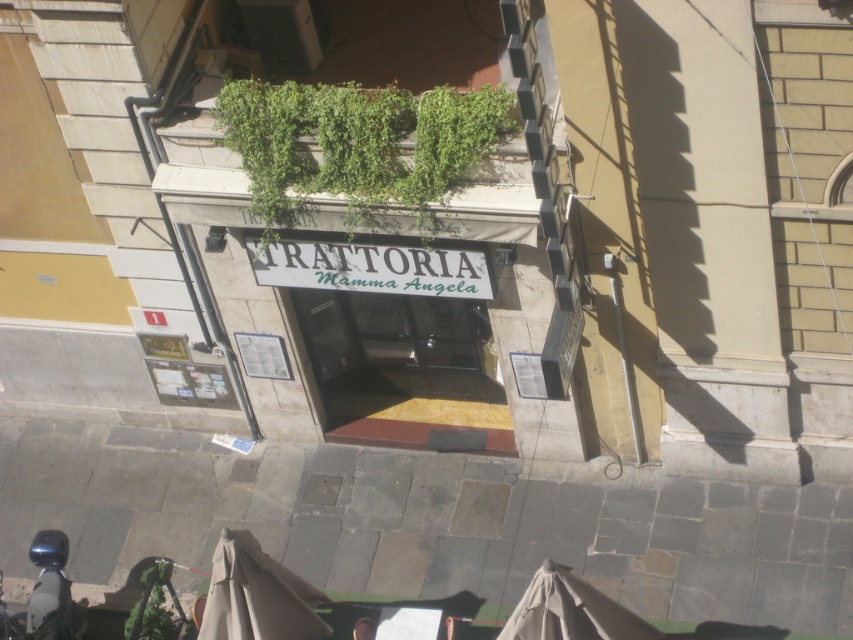
Question: Which of the following is the farthest from the observer?

Choices:
 (A) (509, 198)
 (B) (6, 616)
 (C) (144, 628)
 (D) (396, 100)

Answer: (B)

Question: Among these objects, which one is nearest to the camera?

Choices:
 (A) shiny blue motorcycle at lower left
 (B) green leafy plant at center
 (C) green leafy plant at lower left

Answer: (B)

Question: From the image, what is the correct spatial relationship of black glass door at center in relation to shiny blue motorcycle at lower left?

Choices:
 (A) right
 (B) left

Answer: (A)

Question: Can you confirm if shiny blue motorcycle at lower left is wider than green leafy plant at lower left?

Choices:
 (A) yes
 (B) no

Answer: (A)

Question: Observing the image, what is the correct spatial positioning of white stone signboard at center in reference to shiny blue motorcycle at lower left?

Choices:
 (A) above
 (B) below

Answer: (A)

Question: Which object appears farthest from the camera in this image?

Choices:
 (A) black glass door at center
 (B) white stone signboard at center
 (C) shiny blue motorcycle at lower left
 (D) green leafy plant at center

Answer: (A)